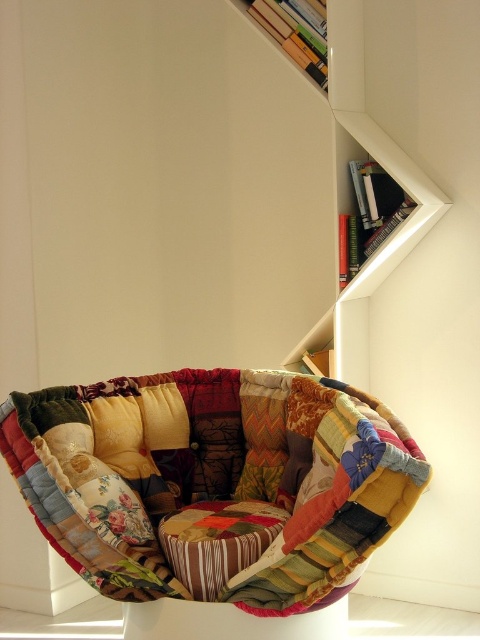
Question: Is patchwork fabric cushion at center to the right of wooden bookshelf at upper right from the viewer's perspective?

Choices:
 (A) yes
 (B) no

Answer: (B)

Question: Does patchwork fabric cushion at center have a greater width compared to wooden bookshelf at upper right?

Choices:
 (A) yes
 (B) no

Answer: (A)

Question: Considering the relative positions of patchwork fabric cushion at center and wooden bookshelf at upper right in the image provided, where is patchwork fabric cushion at center located with respect to wooden bookshelf at upper right?

Choices:
 (A) below
 (B) above

Answer: (A)

Question: Which object appears closest to the camera in this image?

Choices:
 (A) patchwork fabric cushion at center
 (B) wooden bookshelf at upper right

Answer: (A)

Question: Which object appears closest to the camera in this image?

Choices:
 (A) patchwork fabric cushion at center
 (B) wooden bookshelf at upper right

Answer: (A)